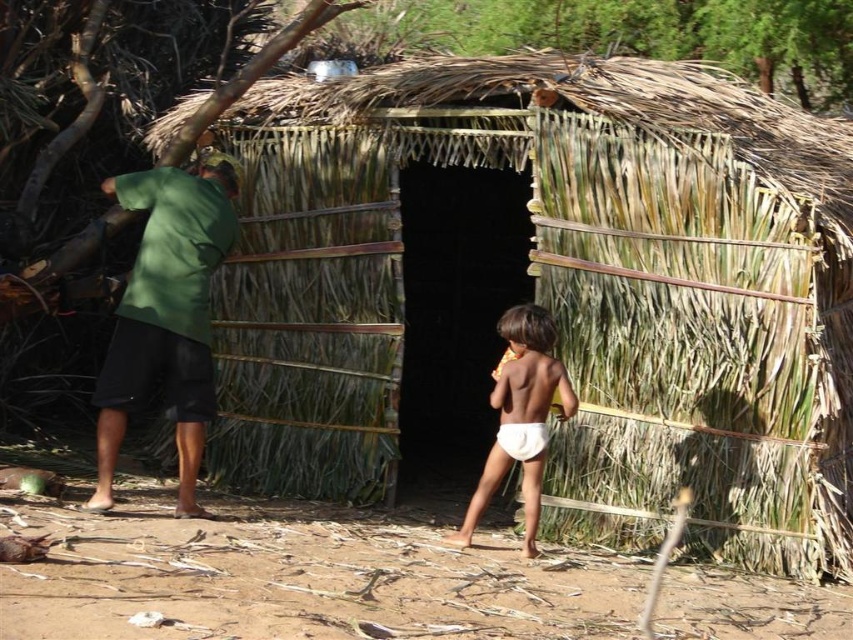
Question: Is green fabric shirt at left bigger than white cloth diaper at center?

Choices:
 (A) no
 (B) yes

Answer: (B)

Question: Estimate the real-world distances between objects in this image. Which object is closer to the white cloth at center?

Choices:
 (A) green fabric shirt at left
 (B) white cloth diaper at center

Answer: (B)

Question: Which of the following is the farthest from the observer?

Choices:
 (A) (474, 500)
 (B) (544, 445)

Answer: (A)

Question: Is the position of white cloth at center more distant than that of white cloth diaper at center?

Choices:
 (A) yes
 (B) no

Answer: (B)

Question: Which point appears closest to the camera in this image?

Choices:
 (A) (527, 438)
 (B) (190, 493)
 (C) (525, 461)

Answer: (A)

Question: In this image, where is white cloth at center located relative to white cloth diaper at center?

Choices:
 (A) right
 (B) left

Answer: (B)